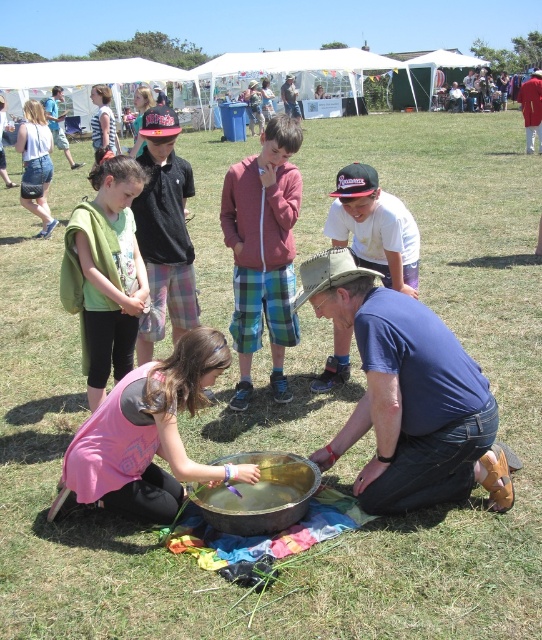
Question: Estimate the real-world distances between objects in this image. Which object is farther from the metallic gold bowl at lower center?

Choices:
 (A) blue cotton shirt at center
 (B) white cotton shirt at center
 (C) green fleece jacket at center
 (D) matte black shirt at center

Answer: (D)

Question: Among these points, which one is nearest to the camera?

Choices:
 (A) (360, 282)
 (B) (190, 465)
 (C) (530, 131)
 (D) (319, 483)

Answer: (B)

Question: Is gold metallic bowl at center above denim jacket at center?

Choices:
 (A) no
 (B) yes

Answer: (A)

Question: Can you confirm if blue cotton shirt at center is wider than white cotton shirt at center?

Choices:
 (A) no
 (B) yes

Answer: (B)

Question: Which of the following is the farthest from the observer?

Choices:
 (A) (380, 381)
 (B) (48, 106)
 (C) (535, 113)

Answer: (B)

Question: From the image, what is the correct spatial relationship of blue cotton shirt at center in relation to red fabric shirt at upper right?

Choices:
 (A) below
 (B) above

Answer: (A)